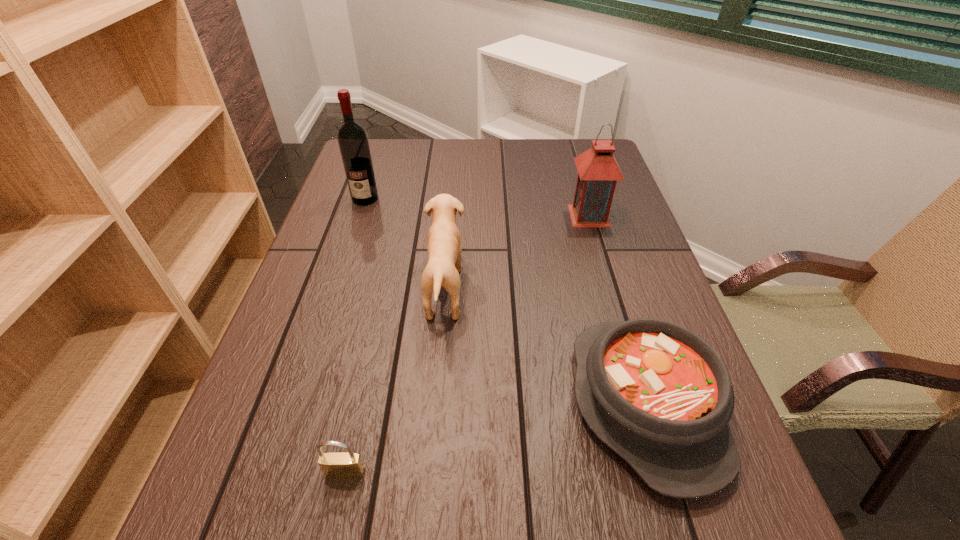
You are a GUI agent. You are given a task and a screenshot of the screen. Output one action in this format:
    pyautogui.click(x=<x>, y=<y>)
    Task: Click on the vacant point located 0.060m on the front-facing side of the padlock
    This screenshot has height=540, width=960.
    Given the screenshot: What is the action you would take?
    pos(335,521)

Locate an element on the screen. Image resolution: width=960 pixels, height=540 pixels. object that is positioned at the left edge is located at coordinates (352, 138).

You are a GUI agent. You are given a task and a screenshot of the screen. Output one action in this format:
    pyautogui.click(x=<x>, y=<y>)
    Task: Click on the lantern that is positioned at the right edge
    The height and width of the screenshot is (540, 960).
    Given the screenshot: What is the action you would take?
    click(x=598, y=171)

Locate an element on the screen. The image size is (960, 540). casserole located at the right edge is located at coordinates (657, 394).

This screenshot has height=540, width=960. What are the coordinates of `vacant space at the far edge` in the screenshot? It's located at (543, 161).

At what (x,y) coordinates should I click in order to perform the action: click on vacant space at the near edge of the desktop. Please return your answer as a coordinate pair (x, y). This screenshot has width=960, height=540. Looking at the image, I should click on pyautogui.click(x=319, y=529).

This screenshot has width=960, height=540. I want to click on free space at the left edge of the desktop, so click(360, 207).

Locate an element on the screen. free region at the right edge is located at coordinates (625, 237).

Locate an element on the screen. The width and height of the screenshot is (960, 540). vacant space at the far left corner is located at coordinates (404, 145).

You are a GUI agent. You are given a task and a screenshot of the screen. Output one action in this format:
    pyautogui.click(x=<x>, y=<y>)
    Task: Click on the free space between the fourth object from right to left and the lantern
    
    Given the screenshot: What is the action you would take?
    pyautogui.click(x=468, y=344)